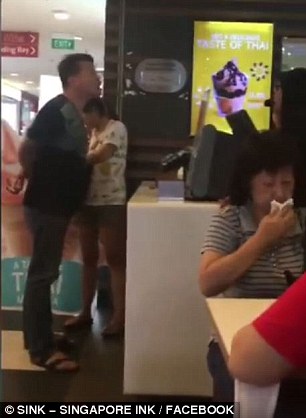
Identify the location of ceiling. This screenshot has height=418, width=306. (84, 13).